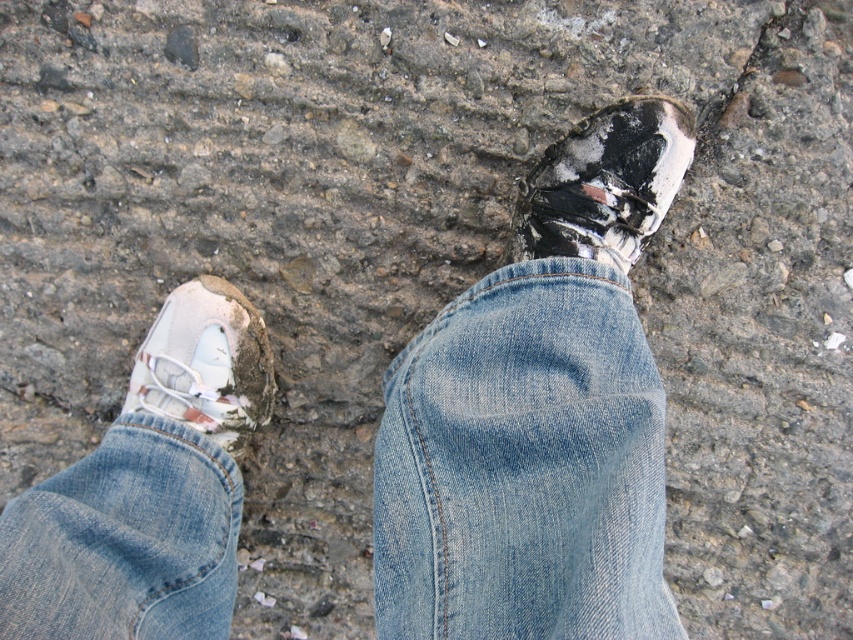
Looking at this image, you are a photographer trying to capture a close shot of the white matte shoe at upper right and the white matte shoe at lower left. Which one would appear closer to the camera in the photo?

The white matte shoe at upper right would appear closer to the camera because it is positioned in front of the white matte shoe at lower left.

You are a designer trying to place a new logo on a pair of light blue denim jeans at center. The jeans are positioned at coordinates 0.728, 0.614 in the image. If you want to place the logo 1 inch to the right of the jeans, where would the new coordinates be?

The new coordinates would be approximately 0.728 plus 0.025 equals 0.753 in the x direction, so the new coordinates would be approximately (x=523, y=481).